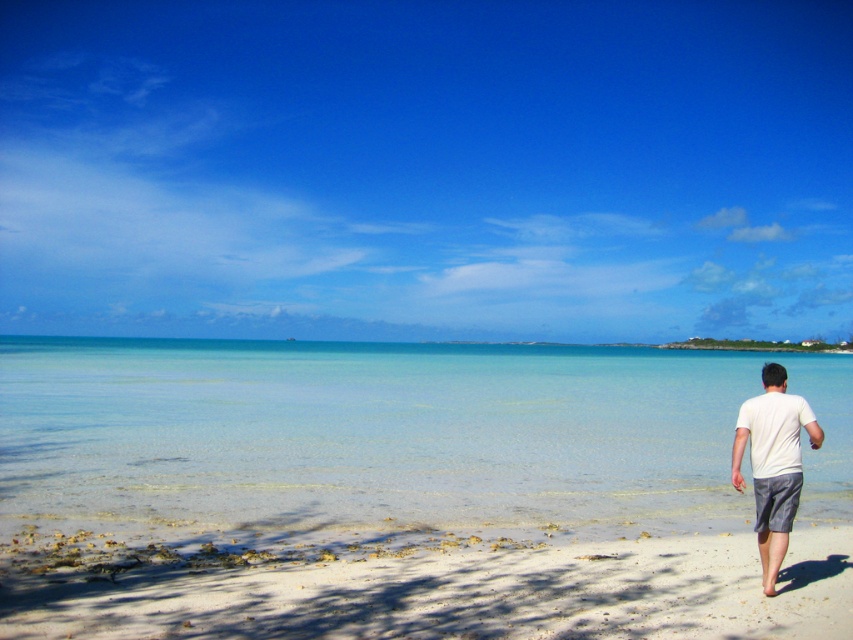
Does white sandy beach at lower right appear over gray cotton shorts at lower right?

Incorrect, white sandy beach at lower right is not positioned above gray cotton shorts at lower right.

Between white sandy beach at lower right and gray cotton shorts at lower right, which one is positioned higher?

gray cotton shorts at lower right is higher up.

Is point (447, 564) positioned behind point (781, 502)?

Yes, point (447, 564) is farther from viewer.

What are the coordinates of `white sandy beach at lower right` in the screenshot? It's located at (424, 582).

Which is more to the right, white sandy beach at lower right or white cotton t-shirt at right?

Positioned to the right is white cotton t-shirt at right.

Who is more distant from viewer, [36,566] or [767,372]?

The point [36,566] is behind.

At what (x,y) coordinates should I click in order to perform the action: click on white sandy beach at lower right. Please return your answer as a coordinate pair (x, y). Looking at the image, I should click on (424, 582).

Is white cotton t-shirt at right below gray cotton shorts at lower right?

Actually, white cotton t-shirt at right is above gray cotton shorts at lower right.

Who is positioned more to the right, white cotton t-shirt at right or gray cotton shorts at lower right?

From the viewer's perspective, white cotton t-shirt at right appears more on the right side.

What do you see at coordinates (773, 464) in the screenshot? The width and height of the screenshot is (853, 640). I see `white cotton t-shirt at right` at bounding box center [773, 464].

At what (x,y) coordinates should I click in order to perform the action: click on white cotton t-shirt at right. Please return your answer as a coordinate pair (x, y). This screenshot has width=853, height=640. Looking at the image, I should click on pyautogui.click(x=773, y=464).